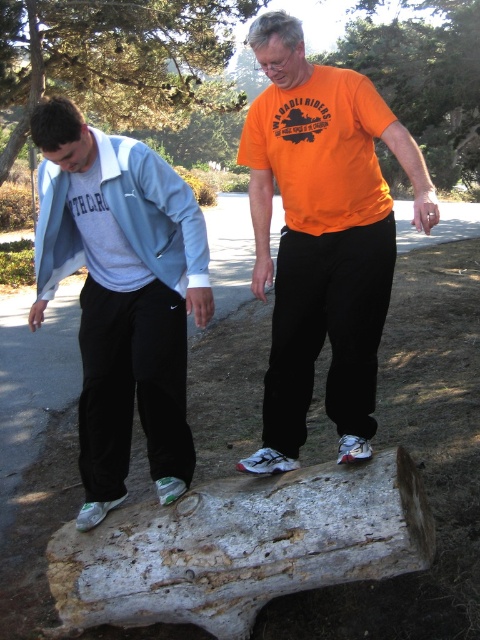
Is point (284, 196) behind point (172, 209)?

No.

Is point (376, 106) farther from viewer compared to point (135, 173)?

No, (376, 106) is closer to viewer.

Locate an element on the screen. orange matte t-shirt at center is located at coordinates (322, 237).